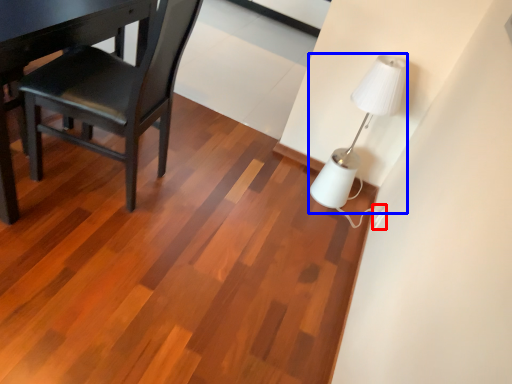
Question: Which object is closer to the camera taking this photo, electric outlet (highlighted by a red box) or lamp (highlighted by a blue box)?

Choices:
 (A) electric outlet
 (B) lamp

Answer: (B)